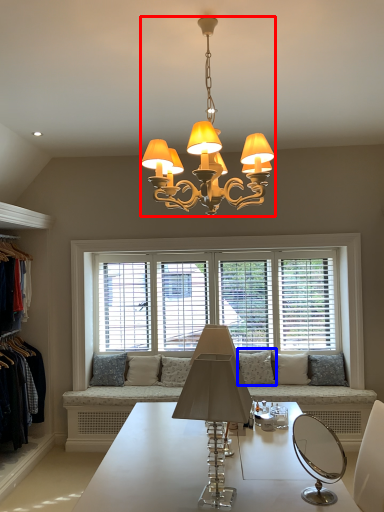
Question: Which of the following is the closest to the observer, lamp (highlighted by a red box) or pillow (highlighted by a blue box)?

Choices:
 (A) lamp
 (B) pillow

Answer: (A)